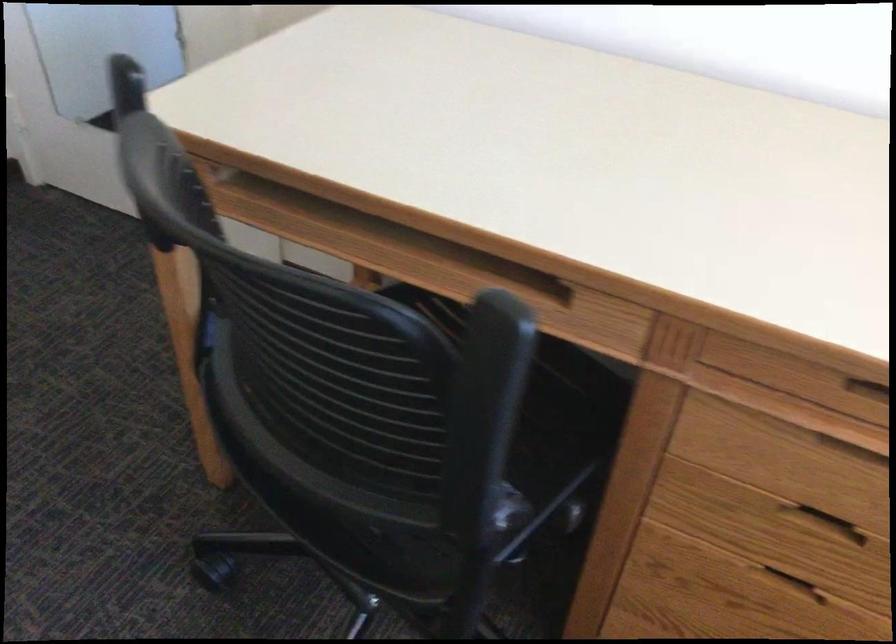
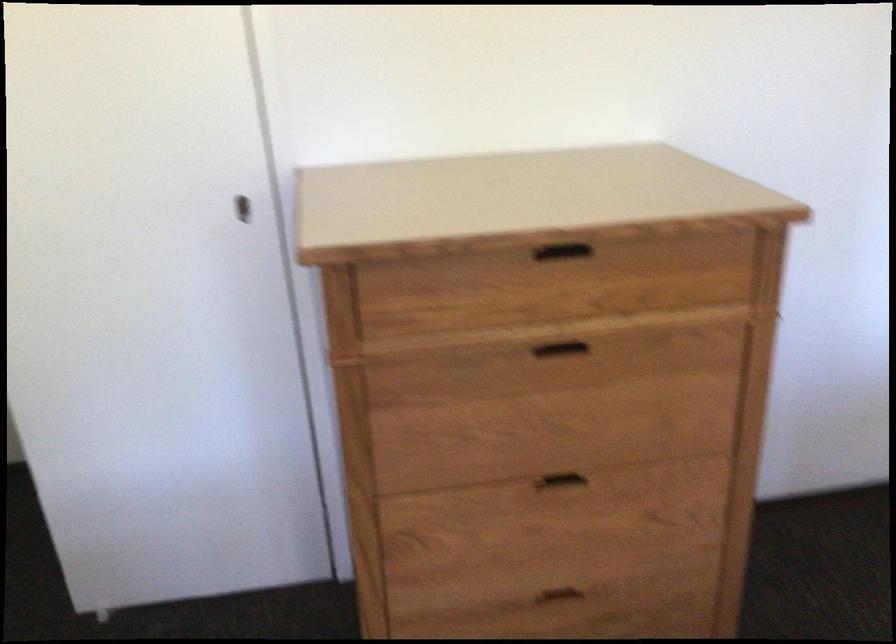
Question: The images are taken continuously from a first-person perspective. In which direction is your viewpoint rotating?

Choices:
 (A) Left
 (B) Right
 (C) Up
 (D) Down

Answer: (A)